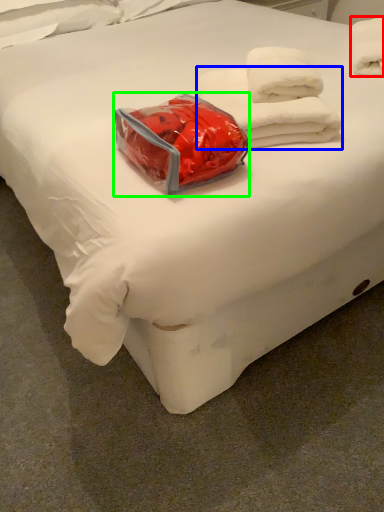
Question: Based on their relative distances, which object is farther from towel (highlighted by a red box)? Choose from towel (highlighted by a blue box) and package (highlighted by a green box).

Choices:
 (A) towel
 (B) package

Answer: (B)